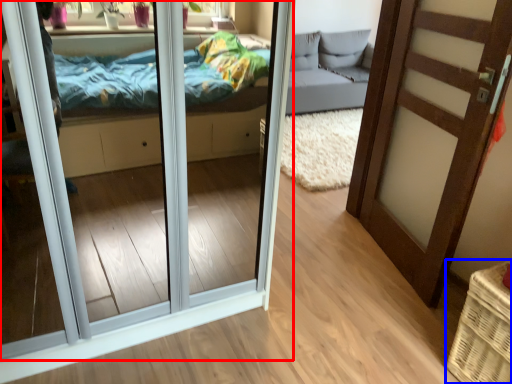
Question: Among these objects, which one is farthest to the camera, door (highlighted by a red box) or basket (highlighted by a blue box)?

Choices:
 (A) door
 (B) basket

Answer: (B)